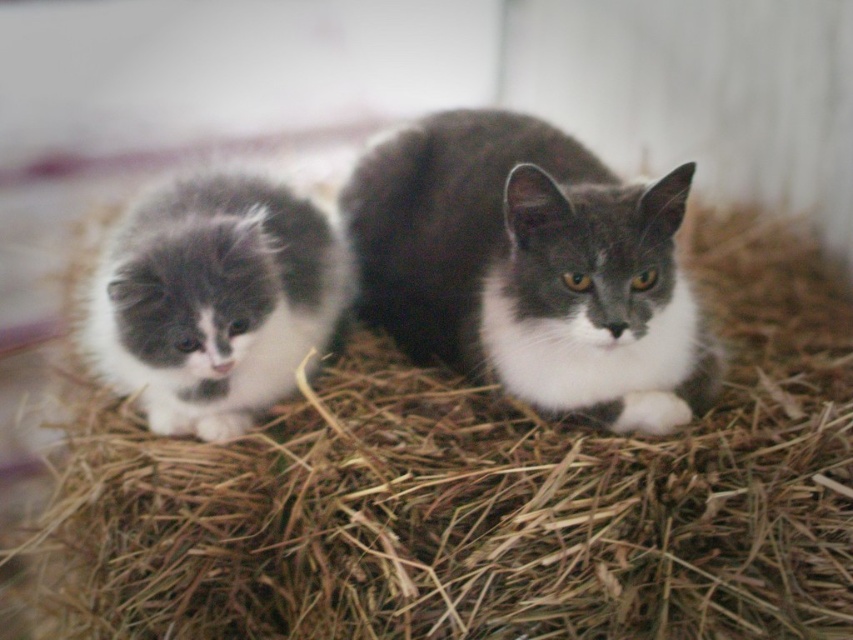
Question: Which point is farther from the camera taking this photo?

Choices:
 (A) (412, 387)
 (B) (543, 372)

Answer: (A)

Question: Is gray fluffy cat at center further to camera compared to fluffy gray kitten at left?

Choices:
 (A) no
 (B) yes

Answer: (B)

Question: Can you confirm if brown straw at center is positioned to the right of fluffy gray kitten at left?

Choices:
 (A) no
 (B) yes

Answer: (B)

Question: Which of the following is the farthest from the observer?

Choices:
 (A) pos(624,396)
 (B) pos(486,625)

Answer: (A)

Question: Which of the following is the farthest from the observer?

Choices:
 (A) brown straw at center
 (B) fluffy gray kitten at left

Answer: (B)

Question: Does brown straw at center appear over gray fluffy cat at center?

Choices:
 (A) no
 (B) yes

Answer: (A)